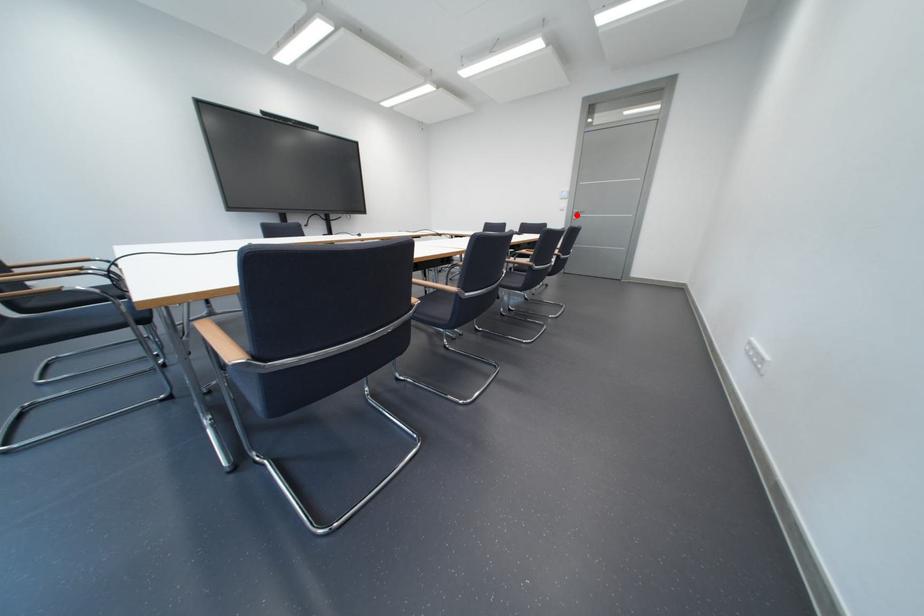
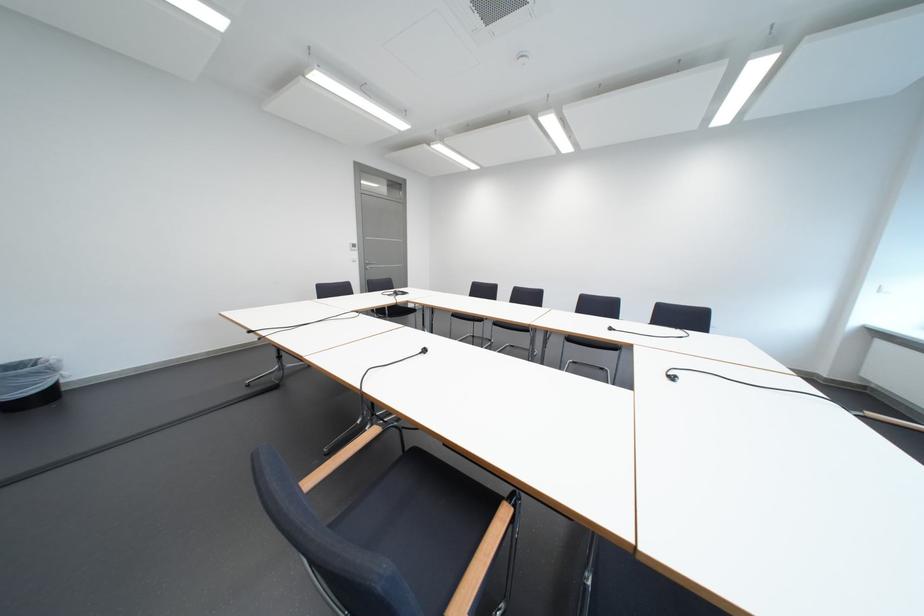
Locate, in the second image, the point that corresponds to the highlighted location in the first image.

(369, 265)